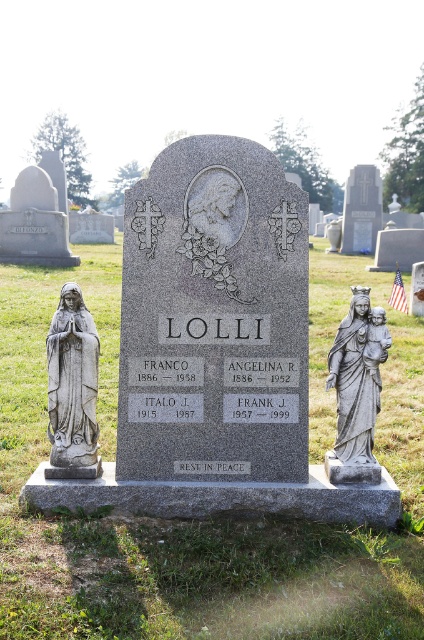
Which is above, gray stone statue at left or gray stone statue of mary holding baby at right?

gray stone statue of mary holding baby at right is above.

Is point (67, 436) closer to camera compared to point (363, 296)?

No, it is behind (363, 296).

This screenshot has height=640, width=424. Identify the location of gray stone statue at left. (72, 387).